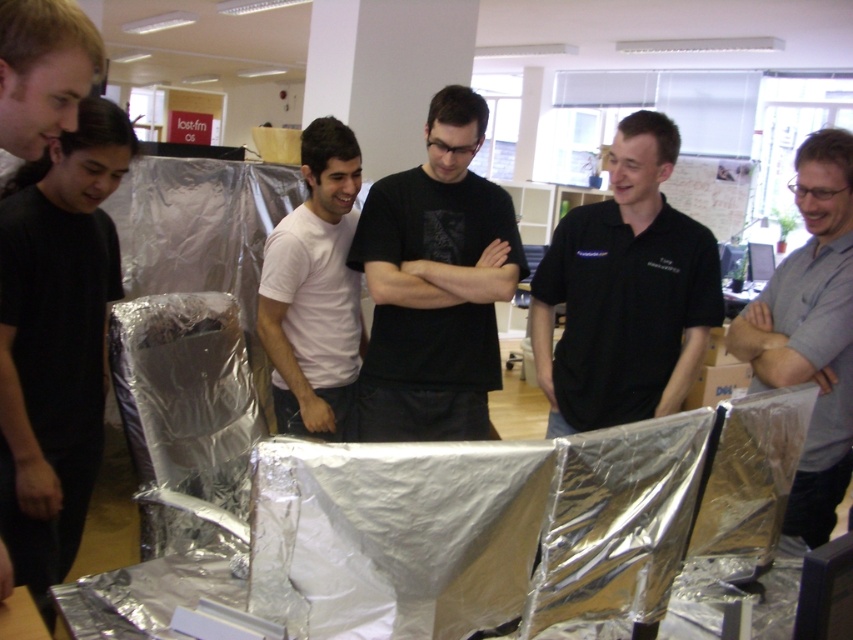
Question: In this image, where is black matte t-shirt at left located relative to white matte t-shirt at center?

Choices:
 (A) below
 (B) above

Answer: (A)

Question: Based on their relative distances, which object is nearer to the black matte t-shirt at center?

Choices:
 (A) gray matte shirt at center
 (B) white matte t-shirt at center
 (C) black matte t-shirt at left
 (D) black shirt at center

Answer: (B)

Question: Based on their relative distances, which object is farther from the black shirt at center?

Choices:
 (A) black matte t-shirt at center
 (B) black matte t-shirt at left

Answer: (B)

Question: Can you confirm if black shirt at center is wider than white matte t-shirt at center?

Choices:
 (A) no
 (B) yes

Answer: (B)

Question: Is black matte t-shirt at center further to camera compared to black shirt at center?

Choices:
 (A) no
 (B) yes

Answer: (B)

Question: Which is nearer to the black matte t-shirt at center?

Choices:
 (A) gray matte shirt at center
 (B) black shirt at center

Answer: (B)